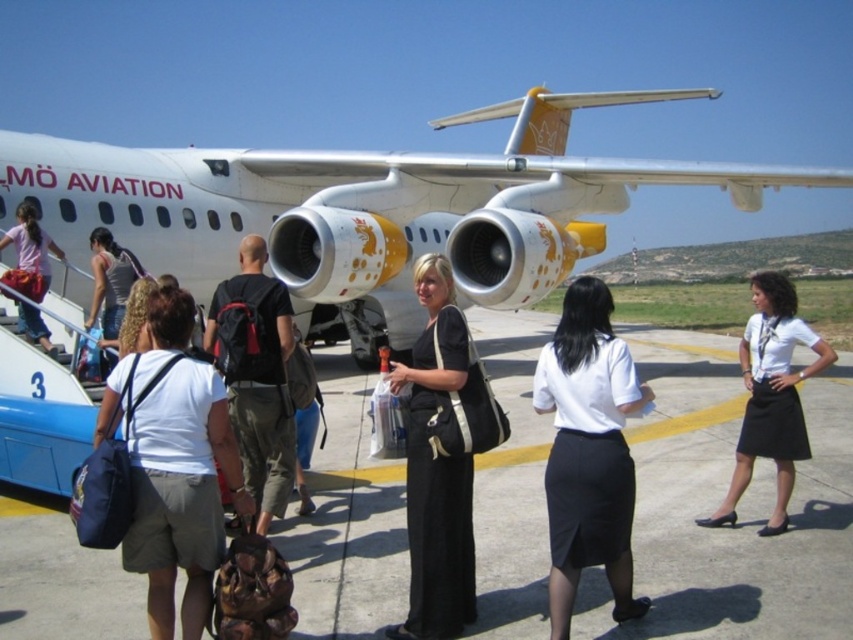
You are a luggage cart that is 1.8 meters wide. You need to move from the gray concrete tarmac at center to the white smooth shirt at center. Is there enough space between them for your cart to pass through?

The distance between the gray concrete tarmac at center and the white smooth shirt at center is 2.21 meters. Since the cart is 1.8 meters wide, there is sufficient space for it to pass through.

You are a passenger at the airport and notice two items of clothing near the boarding staircase. The white smooth skirt at center and the matte pink shirt at left. Which one is nearer to you?

The white smooth skirt at center is closer to the viewer than the matte pink shirt at left, so the white smooth skirt at center is nearer to you.

You are an airport security agent checking the boarding area. You need to locate a passenger wearing a black fabric dress at center. According to the image, where exactly is this passenger located?

The passenger wearing the black fabric dress at center is located at the 2D coordinates point (436, 467).